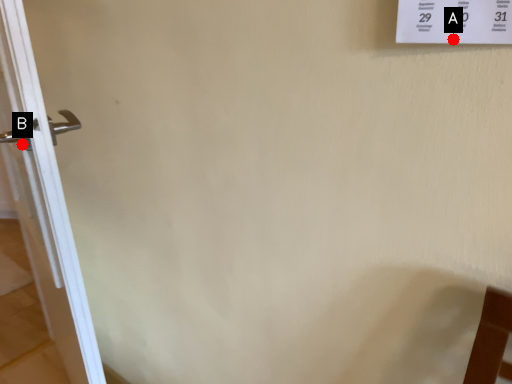
Question: Two points are circled on the image, labeled by A and B beside each circle. Among these points, which one is farthest from the camera?

Choices:
 (A) A is further
 (B) B is further

Answer: (B)